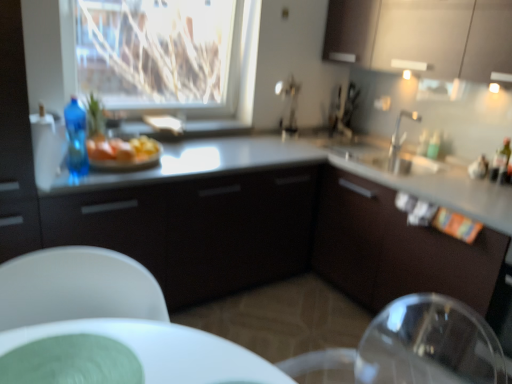
Question: From the image's perspective, would you say matte white cabinets at upper right, the first cabinetry from the top, is shown under white plastic chair at lower left?

Choices:
 (A) yes
 (B) no

Answer: (B)

Question: Is matte white cabinets at upper right, the first cabinetry from the top, positioned before white plastic chair at lower left?

Choices:
 (A) no
 (B) yes

Answer: (A)

Question: Considering the relative positions of matte white cabinets at upper right, which ranks as the 1th cabinetry in right-to-left order, and white plastic chair at lower left in the image provided, is matte white cabinets at upper right, which ranks as the 1th cabinetry in right-to-left order, to the left of white plastic chair at lower left from the viewer's perspective?

Choices:
 (A) no
 (B) yes

Answer: (A)

Question: From a real-world perspective, is matte white cabinets at upper right, the first cabinetry from the top, positioned over white plastic chair at lower left based on gravity?

Choices:
 (A) no
 (B) yes

Answer: (B)

Question: Can you confirm if matte white cabinets at upper right, which ranks as the 1th cabinetry in right-to-left order, is wider than white plastic chair at lower left?

Choices:
 (A) no
 (B) yes

Answer: (A)

Question: Can you see white plastic chair at lower left touching yellow butter at center?

Choices:
 (A) yes
 (B) no

Answer: (B)

Question: Can you confirm if white plastic chair at lower left is positioned to the right of yellow butter at center?

Choices:
 (A) no
 (B) yes

Answer: (B)

Question: From a real-world perspective, is white plastic chair at lower left beneath yellow butter at center?

Choices:
 (A) yes
 (B) no

Answer: (A)

Question: Would you say white plastic chair at lower left is outside yellow butter at center?

Choices:
 (A) no
 (B) yes

Answer: (B)

Question: Is white plastic chair at lower left at the left side of yellow butter at center?

Choices:
 (A) yes
 (B) no

Answer: (B)

Question: Is yellow butter at center located within white plastic chair at lower left?

Choices:
 (A) yes
 (B) no

Answer: (B)

Question: Are transparent glass window at upper center and blue plastic bottle at left far apart?

Choices:
 (A) yes
 (B) no

Answer: (B)